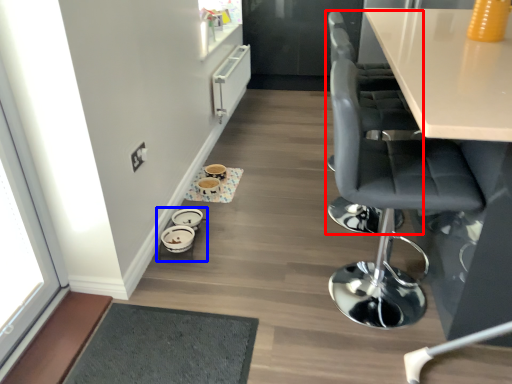
Question: Which of the following is the closest to the observer, chair (highlighted by a red box) or round table (highlighted by a blue box)?

Choices:
 (A) chair
 (B) round table

Answer: (A)